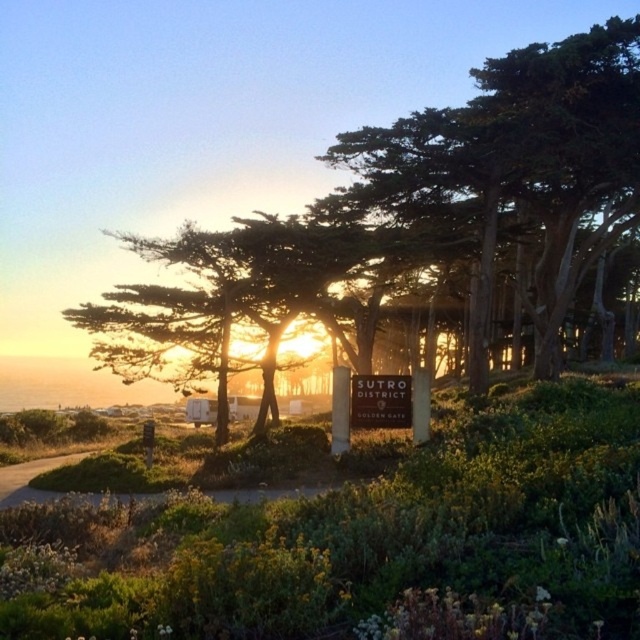
Between point (371, 417) and point (1, 506), which one is positioned behind?

Point (371, 417)

Who is positioned more to the right, white plastic sign at center or brown dirt path at lower left?

white plastic sign at center is more to the right.

Is point (349, 400) behind point (0, 480)?

Yes.

Find the location of `white plastic sign at center`. white plastic sign at center is located at coordinates (380, 401).

Can you confirm if green textured tree at center is positioned above white plastic sign at center?

Yes, green textured tree at center is above white plastic sign at center.

What do you see at coordinates (428, 208) in the screenshot? The image size is (640, 640). I see `green textured tree at center` at bounding box center [428, 208].

Where is `green textured tree at center`? The width and height of the screenshot is (640, 640). green textured tree at center is located at coordinates (428, 208).

Which of these two, green textured tree at center or brown dirt path at lower left, stands taller?

green textured tree at center

Is green textured tree at center below brown dirt path at lower left?

Incorrect, green textured tree at center is not positioned below brown dirt path at lower left.

Find the location of a particular element. green textured tree at center is located at coordinates (428, 208).